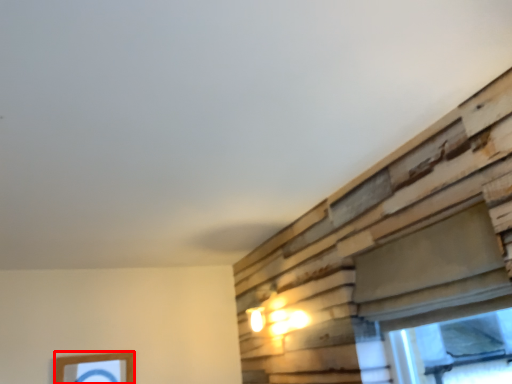
Question: Considering the relative positions of picture frame (annotated by the red box) and window in the image provided, where is picture frame (annotated by the red box) located with respect to the staircase?

Choices:
 (A) left
 (B) right

Answer: (A)